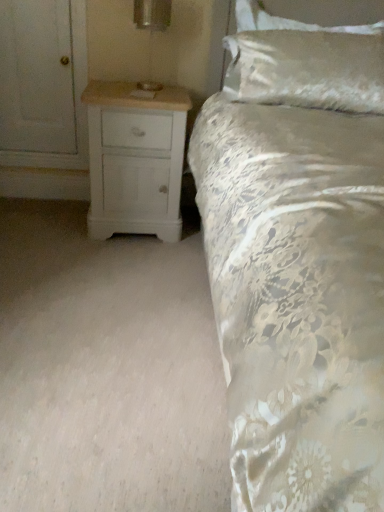
Question: Is silky white pillow at upper right to the left or to the right of metallic silver table lamp at upper center in the image?

Choices:
 (A) left
 (B) right

Answer: (B)

Question: Is silky white pillow at upper right taller or shorter than metallic silver table lamp at upper center?

Choices:
 (A) short
 (B) tall

Answer: (B)

Question: Estimate the real-world distances between objects in this image. Which object is farther from the metallic silver table lamp at upper center?

Choices:
 (A) white wood chest of drawers at lower left
 (B) silky white pillow at upper right

Answer: (B)

Question: Which of these objects is positioned closest to the white wood chest of drawers at lower left?

Choices:
 (A) metallic silver table lamp at upper center
 (B) silky white pillow at upper right

Answer: (A)